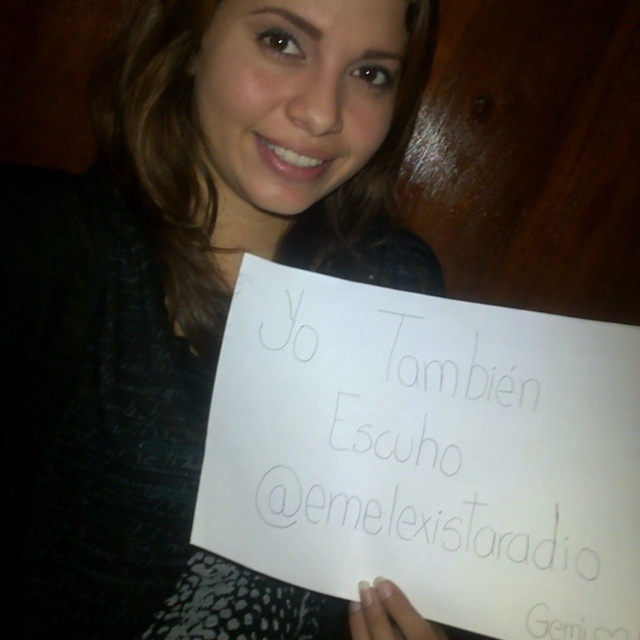
Looking at this image, you are designing a poster for a community event and need to choose between the matte black paper at center and the white paper at center based on their sizes. Which paper is taller?

The matte black paper at center is much taller than the white paper at center, so it is the better choice for the poster if a taller size is needed.

In the scene shown: You are a graphic designer who needs to place a new element between the matte black paper at center and the white paper at center. Given that the minimum spacing required between elements is 8 inches, can you fit the new element between them?

The matte black paper at center and white paper at center are currently 7.15 inches apart. Since the required minimum spacing is 8 inches, the new element cannot be placed between them without violating the spacing requirement.